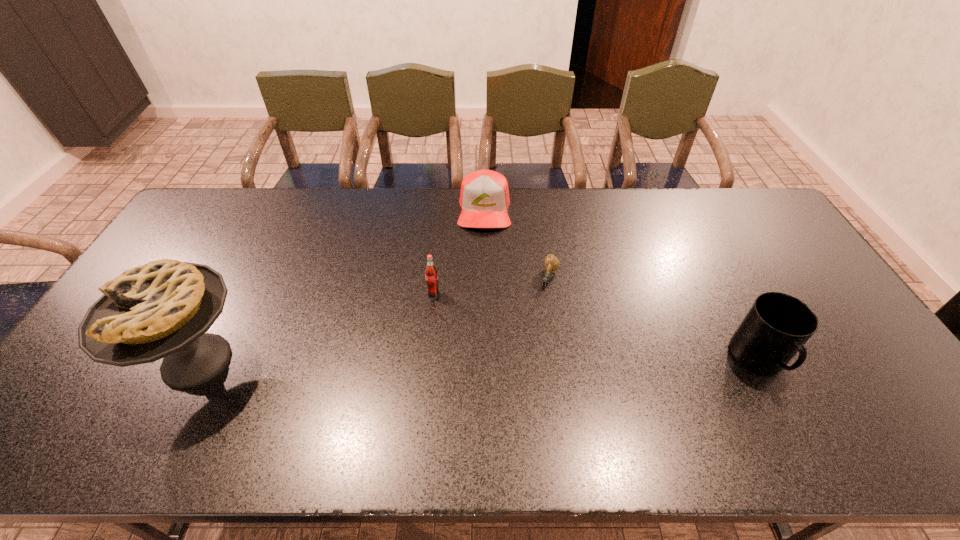
Where is `free spot between the escargot and the second object from left to right`? free spot between the escargot and the second object from left to right is located at coordinates (492, 286).

Image resolution: width=960 pixels, height=540 pixels. What are the coordinates of `free spot between the tallest object and the fourth object from left to right` in the screenshot? It's located at (372, 319).

I want to click on free spot between the rightmost object and the second shortest object, so click(622, 285).

Where is `vacant area between the pie and the second object from right to left`? vacant area between the pie and the second object from right to left is located at coordinates (372, 319).

Identify the location of free space between the pie and the fourth tallest object. This screenshot has height=540, width=960. (341, 285).

Identify the location of unoccupied position between the farthest object and the rightmost object. The image size is (960, 540). (622, 285).

Where is `empty space that is in between the fourth object from left to right and the mug`? This screenshot has width=960, height=540. empty space that is in between the fourth object from left to right and the mug is located at coordinates (655, 319).

Locate an element on the screen. free area in between the baseball cap and the rightmost object is located at coordinates (622, 285).

Find the location of a particular element. This screenshot has height=540, width=960. empty space between the second object from left to right and the farthest object is located at coordinates (459, 252).

Find the location of a particular element. The width and height of the screenshot is (960, 540). free spot between the farthest object and the escargot is located at coordinates tap(516, 244).